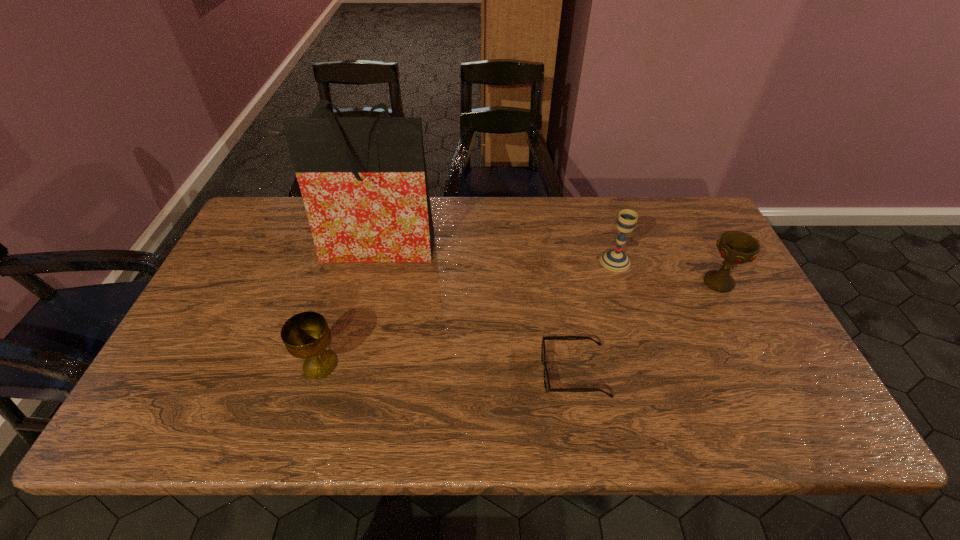
Find the location of a particular element. The image size is (960, 540). free space located 0.140m at the front lenses of the shortest object is located at coordinates (483, 373).

This screenshot has height=540, width=960. Find the location of `free region located 0.290m at the front lenses of the shortest object`. free region located 0.290m at the front lenses of the shortest object is located at coordinates (419, 373).

This screenshot has height=540, width=960. Identify the location of vacant space situated 0.320m at the front lenses of the shortest object. (406, 373).

Where is `object that is at the far edge`? This screenshot has width=960, height=540. object that is at the far edge is located at coordinates (363, 180).

The image size is (960, 540). In order to click on object present at the near edge in this screenshot , I will do `click(548, 389)`.

Find the location of a particular element. This screenshot has height=540, width=960. object at the right edge is located at coordinates (735, 247).

Where is `free space at the far edge of the desktop`? The height and width of the screenshot is (540, 960). free space at the far edge of the desktop is located at coordinates (601, 200).

Locate an element on the screen. vacant region at the near edge of the desktop is located at coordinates (284, 415).

You are a GUI agent. You are given a task and a screenshot of the screen. Output one action in this format:
    pyautogui.click(x=<x>, y=<y>)
    Task: Click on the free location at the left edge
    The width and height of the screenshot is (960, 540).
    Given the screenshot: What is the action you would take?
    pyautogui.click(x=210, y=297)

The image size is (960, 540). In the image, there is a desktop. In order to click on free region at the right edge in this screenshot , I will do `click(695, 295)`.